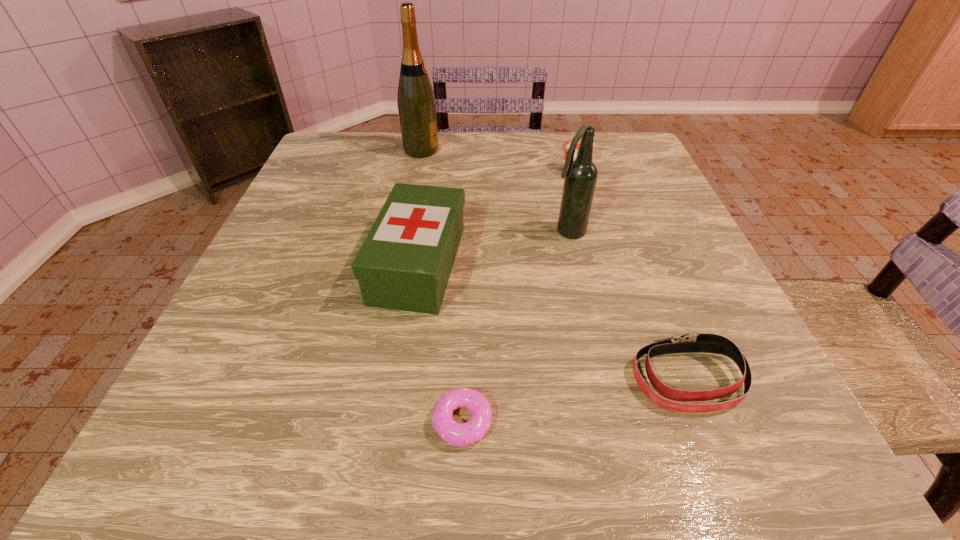
You are a GUI agent. You are given a task and a screenshot of the screen. Output one action in this format:
    pyautogui.click(x=<x>, y=<y>)
    Task: Click on the free space that satisfies the following two spatial constraints: 1. on the front side of the doughnut; 2. on the right side of the first-aid kit
    The height and width of the screenshot is (540, 960).
    Given the screenshot: What is the action you would take?
    pyautogui.click(x=396, y=421)

I want to click on free spot that satisfies the following two spatial constraints: 1. on the back side of the doughnut; 2. on the left side of the dog collar, so click(x=464, y=379).

Locate an element on the screen. The width and height of the screenshot is (960, 540). vacant region that satisfies the following two spatial constraints: 1. on the front-facing side of the tallest object; 2. on the right side of the first-aid kit is located at coordinates (398, 265).

Locate an element on the screen. Image resolution: width=960 pixels, height=540 pixels. vacant area that satisfies the following two spatial constraints: 1. on the front side of the first-aid kit; 2. on the right side of the second shortest object is located at coordinates (401, 379).

You are a GUI agent. You are given a task and a screenshot of the screen. Output one action in this format:
    pyautogui.click(x=<x>, y=<y>)
    Task: Click on the vacant space that satisfies the following two spatial constraints: 1. on the front-facing side of the tallest object; 2. on the back side of the first-aid kit
    Image resolution: width=960 pixels, height=540 pixels.
    Given the screenshot: What is the action you would take?
    pyautogui.click(x=398, y=265)

Find the location of a particular element. The image size is (960, 540). free region that satisfies the following two spatial constraints: 1. on the front-facing side of the farthest object; 2. on the right side of the second tallest object is located at coordinates (405, 232).

Find the location of a particular element. This screenshot has height=540, width=960. vacant space that satisfies the following two spatial constraints: 1. on the front-facing side of the fifth tallest object; 2. on the right side of the wine bottle is located at coordinates (376, 379).